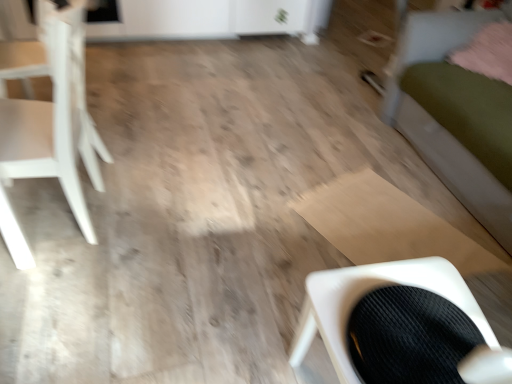
Question: Is black corduroy chair at lower right, arranged as the 1th chair when viewed from the front, wider than pink fluffy pillow at upper right?

Choices:
 (A) yes
 (B) no

Answer: (B)

Question: Is black corduroy chair at lower right, positioned as the first chair in right-to-left order, oriented away from pink fluffy pillow at upper right?

Choices:
 (A) no
 (B) yes

Answer: (A)

Question: Is black corduroy chair at lower right, arranged as the 1th chair when viewed from the front, far from pink fluffy pillow at upper right?

Choices:
 (A) no
 (B) yes

Answer: (B)

Question: Is black corduroy chair at lower right, which is the second chair in left-to-right order, not within pink fluffy pillow at upper right?

Choices:
 (A) no
 (B) yes

Answer: (B)

Question: From a real-world perspective, is black corduroy chair at lower right, which is the second chair in left-to-right order, physically below pink fluffy pillow at upper right?

Choices:
 (A) yes
 (B) no

Answer: (A)

Question: Can you confirm if black corduroy chair at lower right, which is the second chair in left-to-right order, is positioned to the right of pink fluffy pillow at upper right?

Choices:
 (A) yes
 (B) no

Answer: (B)

Question: Does green fabric bed at right have a greater width compared to pink fluffy pillow at upper right?

Choices:
 (A) no
 (B) yes

Answer: (B)

Question: Is green fabric bed at right positioned with its back to pink fluffy pillow at upper right?

Choices:
 (A) yes
 (B) no

Answer: (A)

Question: Is green fabric bed at right touching pink fluffy pillow at upper right?

Choices:
 (A) yes
 (B) no

Answer: (B)

Question: Are green fabric bed at right and pink fluffy pillow at upper right far apart?

Choices:
 (A) yes
 (B) no

Answer: (B)

Question: Is green fabric bed at right not within pink fluffy pillow at upper right?

Choices:
 (A) yes
 (B) no

Answer: (A)

Question: Does green fabric bed at right have a larger size compared to pink fluffy pillow at upper right?

Choices:
 (A) no
 (B) yes

Answer: (B)

Question: Is pink fluffy pillow at upper right positioned behind black corduroy chair at lower right, positioned as the first chair in right-to-left order?

Choices:
 (A) no
 (B) yes

Answer: (B)